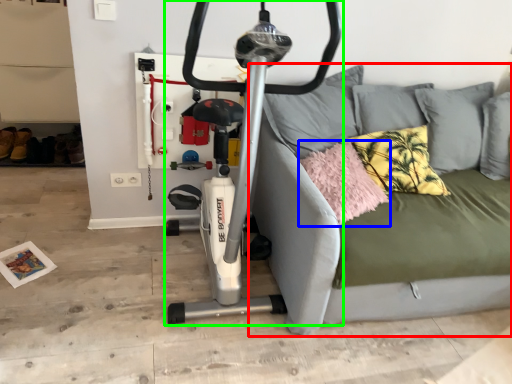
Question: Which object is the closest to the studio couch (highlighted by a red box)? Choose among these: pillow (highlighted by a blue box) or stationary bicycle (highlighted by a green box).

Choices:
 (A) pillow
 (B) stationary bicycle

Answer: (A)